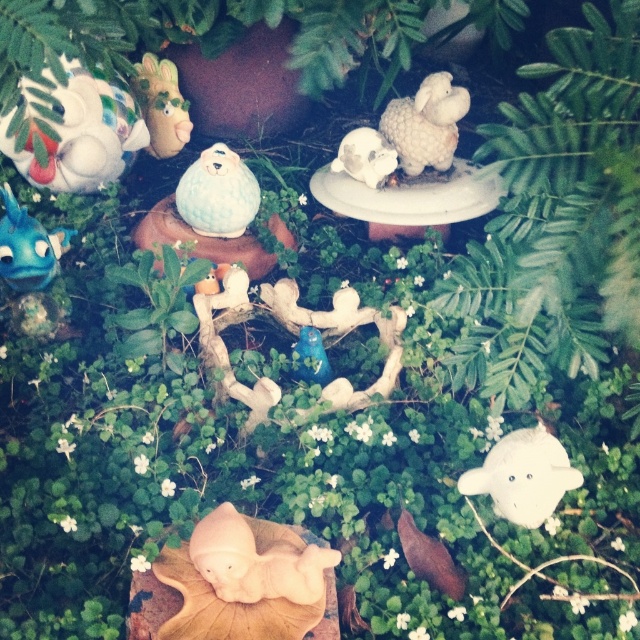
You are a tiny explorer navigating through this miniature garden. You need to move from point A to point B. If point A is at coordinate point (234, 182) and point B is at coordinate point (218, 230), which direction should you move relative to point A to reach point B?

To move from point A at coordinate point (234, 182) to point B at coordinate point (218, 230), you should move northeast. This is because point B has a higher x coordinate and a lower y coordinate compared to point A, indicating a northeast direction.

In the miniature garden scene, there are two animals positioned at the upper parts of the image. The first is a matte white sheep at upper right, and the second is a matte ceramic rabbit at upper left. From the perspective of an observer looking at the image, which of these two animals is positioned to the right side of the other?

The matte white sheep at upper right is positioned to the right of the matte ceramic rabbit at upper left.

You are a small insect observing the miniature garden scene. You want to climb from the green leafy fern at upper center to the matte beige lamb at lower center. Which direction should you move to reach the lamb?

The green leafy fern at upper center is located above the matte beige lamb at lower center, so you should move downward to reach the lamb.